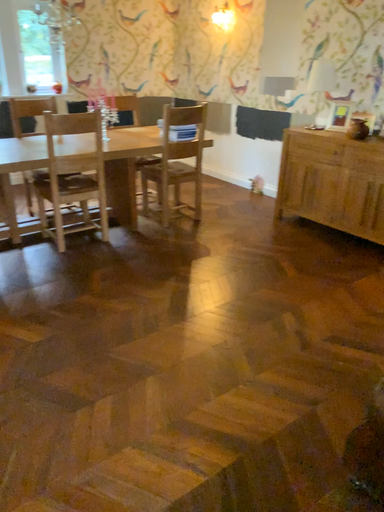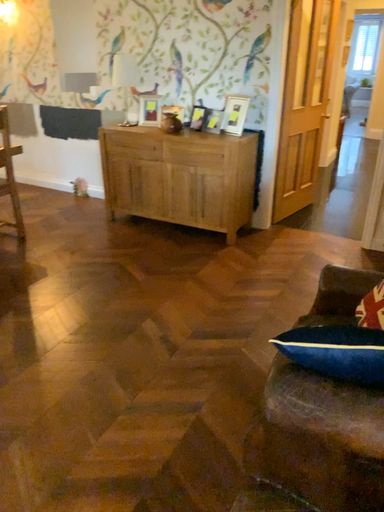
Question: How did the camera likely rotate when shooting the video?

Choices:
 (A) rotated left
 (B) rotated right

Answer: (B)